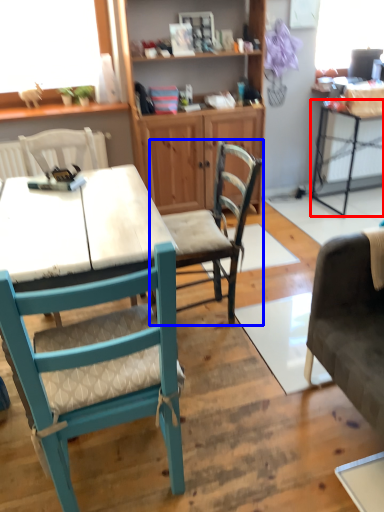
Question: Which point is closer to the camera, table (highlighted by a red box) or chair (highlighted by a blue box)?

Choices:
 (A) table
 (B) chair

Answer: (B)